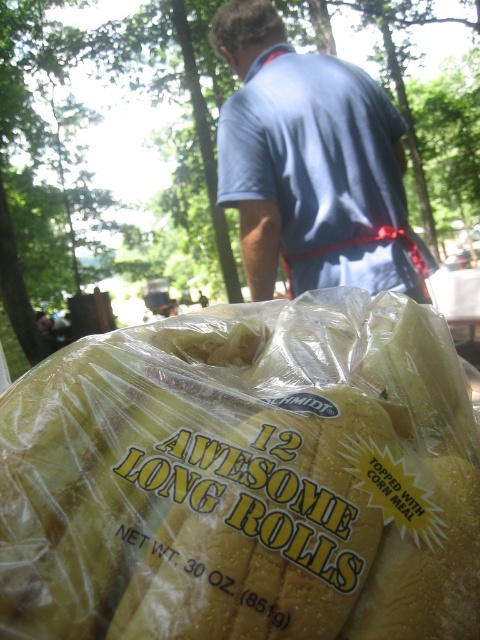
In the scene shown: You are a customer at a bakery and see the yellow plastic bag at bottom and the blue fabric shirt at upper center in the scene. Which object is closer to you?

The yellow plastic bag at bottom is closer to you because it is in front of the blue fabric shirt at upper center.

Looking at this image, you are at a park and see a person holding a yellow plastic bag at bottom and wearing a blue fabric shirt at upper center. Which item is smaller in size?

The yellow plastic bag at bottom is smaller in size compared to the blue fabric shirt at upper center.